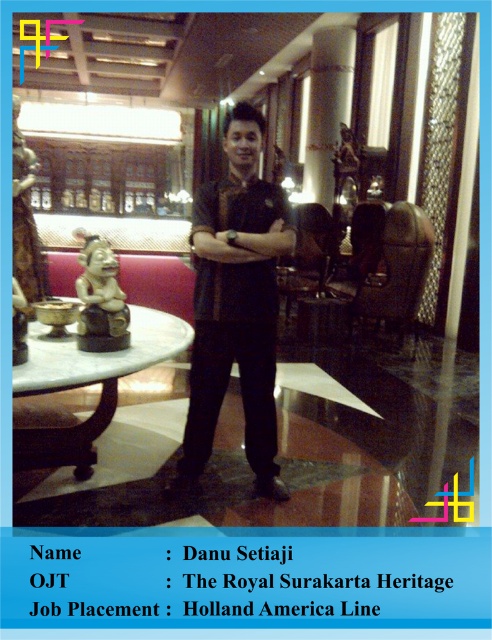
Question: Does matte black shirt at center have a lesser width compared to white marble table at center?

Choices:
 (A) no
 (B) yes

Answer: (B)

Question: Which point is closer to the camera?

Choices:
 (A) matte black shirt at center
 (B) white marble table at center

Answer: (B)

Question: Which of the following is the closest to the observer?

Choices:
 (A) (145, 336)
 (B) (196, 417)

Answer: (B)

Question: Among these objects, which one is farthest from the camera?

Choices:
 (A) matte black shirt at center
 (B) white marble table at center

Answer: (A)

Question: Does matte black shirt at center appear on the right side of white marble table at center?

Choices:
 (A) yes
 (B) no

Answer: (A)

Question: Is matte black shirt at center bigger than white marble table at center?

Choices:
 (A) yes
 (B) no

Answer: (B)